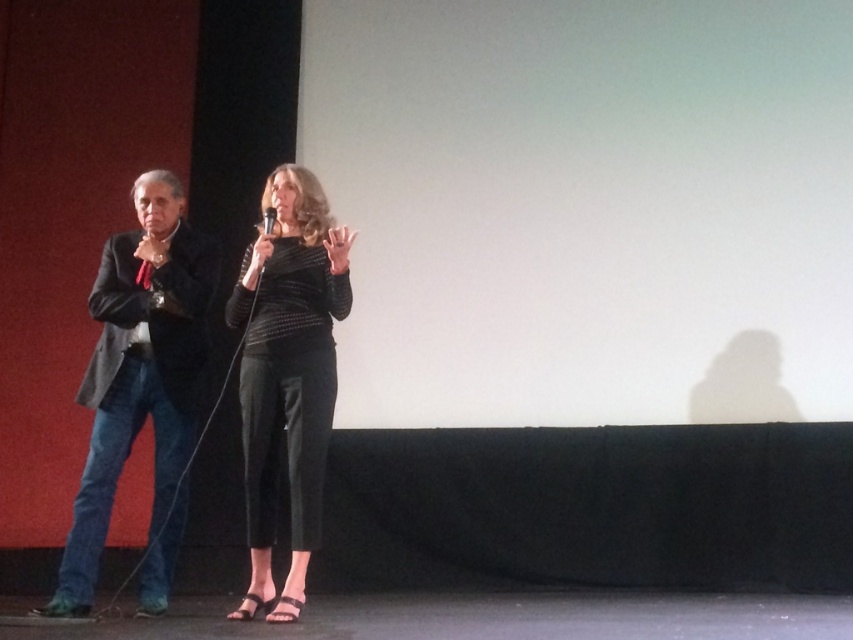
You are an event organizer who needs to place a small podium for the presenter wearing the dark gray suit at left. Based on their position, where should you place the podium relative to their current location?

The dark gray suit at left is located at point [140,385], so the podium should be placed directly in front of this coordinate to ensure the presenter can access it easily during their presentation.

Please look at the stage scene. There is a point marked at coordinates (288, 374). Which object from the scene is located exactly at this point?

The black textured pants at center is represented by point (288, 374).

You are a stagehand setting up a new microphone stand for the black matte microphone at center. The stand needs to be placed so that the microphone is at the same height as the black textured pants at center. Based on the current setup, should you raise or lower the microphone stand?

The black textured pants at center has a greater height compared to the black matte microphone at center. Therefore, you should raise the microphone stand to match the height of the black textured pants at center.